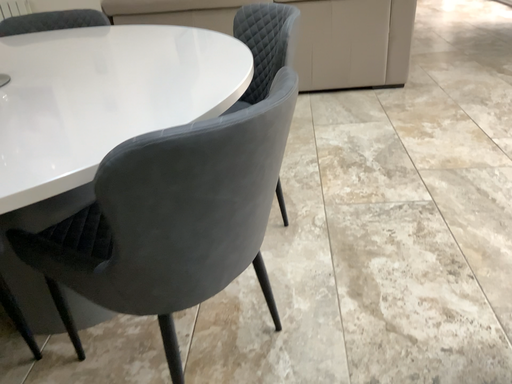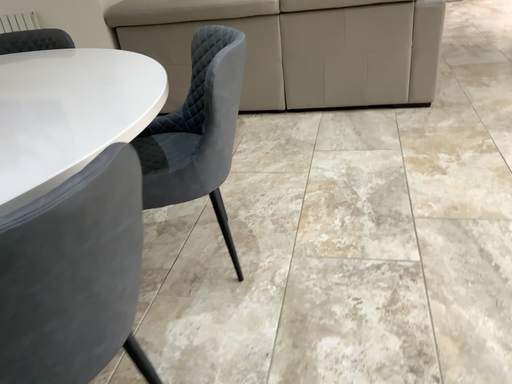
Question: Which way did the camera rotate in the video?

Choices:
 (A) rotated left
 (B) rotated right

Answer: (A)